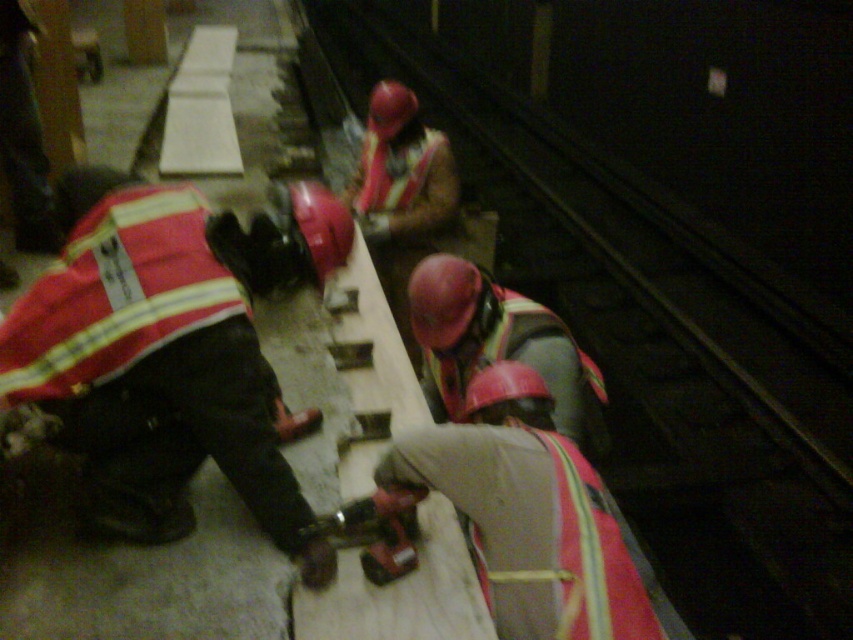
Question: Does red hard hat at center appear on the left side of matte red hard hat at center?

Choices:
 (A) no
 (B) yes

Answer: (A)

Question: Which point is closer to the camera?

Choices:
 (A) red hard hat at center
 (B) matte red hard hat at center

Answer: (A)

Question: Which point is closer to the camera taking this photo?

Choices:
 (A) (599, 410)
 (B) (305, 268)

Answer: (B)

Question: Which point is closer to the camera?

Choices:
 (A) matte red hard hat at center
 (B) reflective safety vest at lower left

Answer: (B)

Question: Does reflective safety vest at lower left appear under red hard hat at center?

Choices:
 (A) no
 (B) yes

Answer: (A)

Question: Is reflective safety vest at lower left behind red hard hat at center?

Choices:
 (A) no
 (B) yes

Answer: (A)